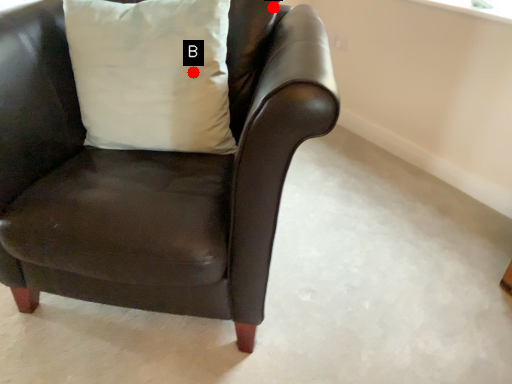
Question: Two points are circled on the image, labeled by A and B beside each circle. Which of the following is the farthest from the observer?

Choices:
 (A) A is further
 (B) B is further

Answer: (A)